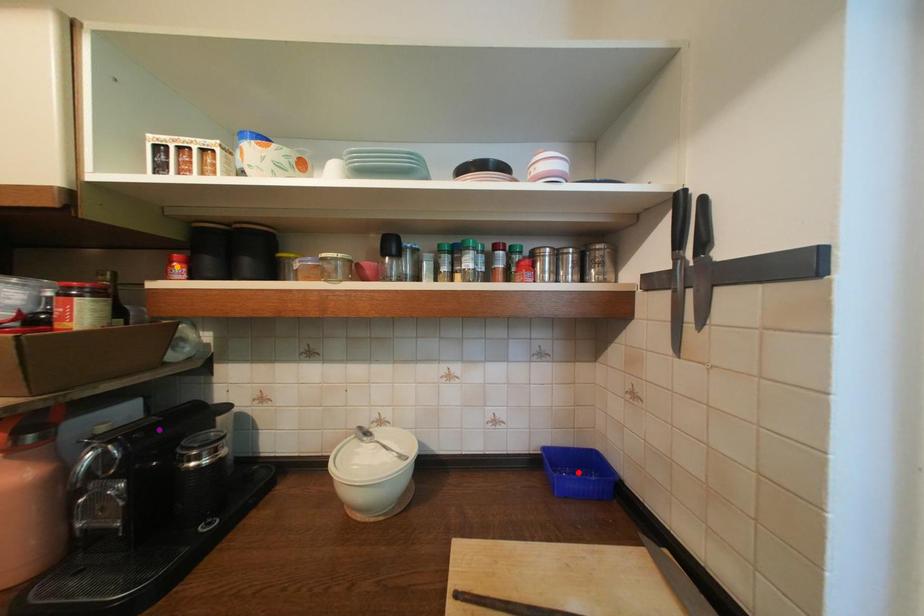
Order these from farthest to nearest:
1. purple point
2. red point
3. orange point

red point → orange point → purple point